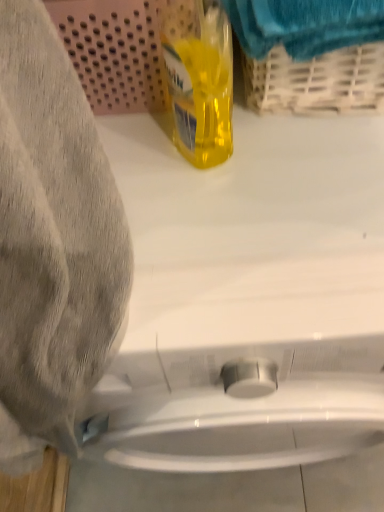
Where is `white glossy washer at center`? This screenshot has height=512, width=384. white glossy washer at center is located at coordinates (249, 248).

The image size is (384, 512). What do you see at coordinates (249, 248) in the screenshot?
I see `white glossy washer at center` at bounding box center [249, 248].

You are a GUI agent. You are given a task and a screenshot of the screen. Output one action in this format:
    pyautogui.click(x=<x>, y=<y>)
    Task: Click on the white glossy washer at center
    The width and height of the screenshot is (384, 512).
    Given the screenshot: What is the action you would take?
    pyautogui.click(x=249, y=248)